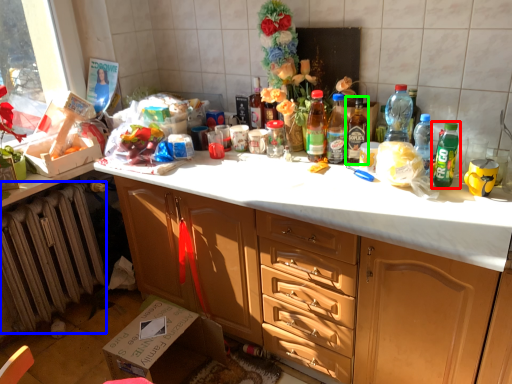
Question: Which is nearer to the bottle (highlighted by a red box)? radiator (highlighted by a blue box) or bottle (highlighted by a green box).

Choices:
 (A) radiator
 (B) bottle

Answer: (B)